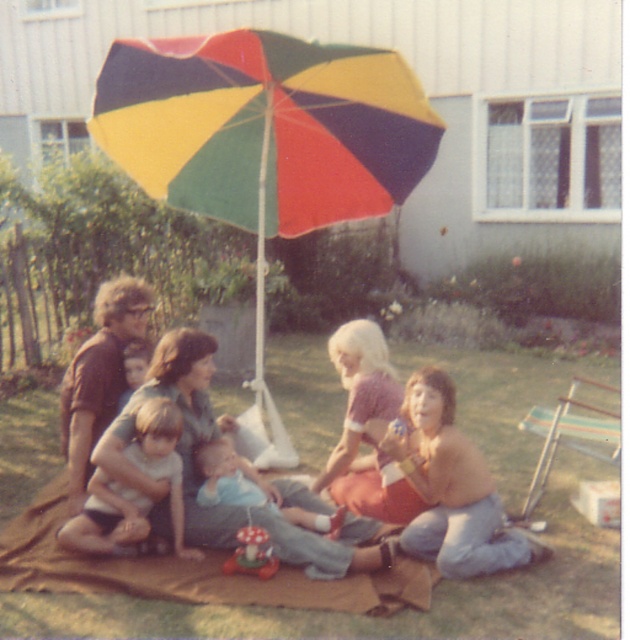
Does matte gray shirt at center have a greater width compared to light brown fabric shorts at lower left?

Correct, the width of matte gray shirt at center exceeds that of light brown fabric shorts at lower left.

Is point (408, 532) positioned before point (135, 436)?

Yes, point (408, 532) is in front of point (135, 436).

Who is more forward, (x=105, y=460) or (x=108, y=499)?

Point (x=105, y=460)

Find the location of `matte gray shirt at center`. matte gray shirt at center is located at coordinates (178, 440).

Between point (197, 506) and point (101, 424), which one is positioned in front?

Point (197, 506)

You are a GUI agent. You are given a task and a screenshot of the screen. Output one action in this format:
    pyautogui.click(x=<x>, y=<y>)
    Task: Click on the matte gray shirt at center
    
    Given the screenshot: What is the action you would take?
    pyautogui.click(x=178, y=440)

Who is more forward, (321, 129) or (146, 467)?

Point (146, 467) is more forward.

Can you confirm if multicolored fabric umbrella at center is bigger than light brown fabric shorts at lower left?

Yes, multicolored fabric umbrella at center is bigger than light brown fabric shorts at lower left.

Is point (115, 72) positioned before point (88, 550)?

No, (115, 72) is further to viewer.

This screenshot has height=640, width=630. What are the coordinates of `multicolored fabric umbrella at center` in the screenshot? It's located at (265, 144).